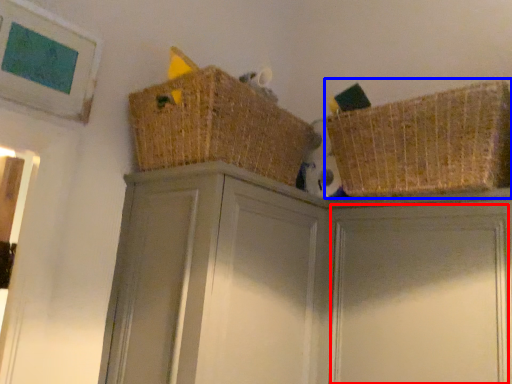
Question: Which object is closer to the camera taking this photo, door (highlighted by a red box) or basket (highlighted by a blue box)?

Choices:
 (A) door
 (B) basket

Answer: (A)